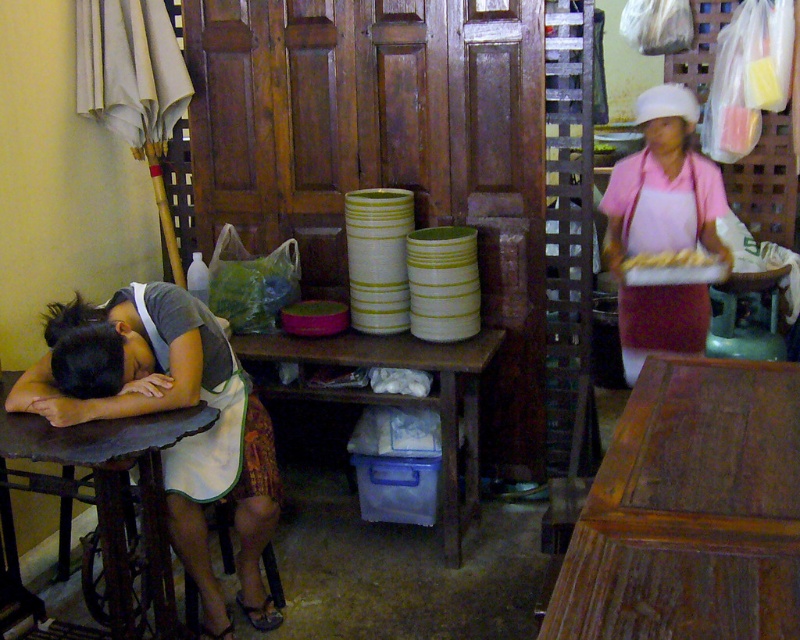
Can you confirm if pink fabric apron at right is positioned above wooden table at center?

Indeed, pink fabric apron at right is positioned over wooden table at center.

Between pink fabric apron at right and wooden table at center, which one is positioned lower?

Positioned lower is wooden table at center.

Which is behind, point (684, 125) or point (438, 372)?

The point (438, 372) is more distant.

Locate an element on the screen. This screenshot has width=800, height=640. pink fabric apron at right is located at coordinates (662, 227).

Who is lower down, pink fabric apron at right or golden crispy bread at center?

Positioned lower is golden crispy bread at center.

Is pink fabric apron at right taller than golden crispy bread at center?

Indeed, pink fabric apron at right has a greater height compared to golden crispy bread at center.

Between point (694, 285) and point (702, 256), which one is positioned in front?

Point (702, 256) is more forward.

Identify the location of pink fabric apron at right. (662, 227).

Can you confirm if wooden table at lower right is bigger than golden crispy bread at center?

Yes.

Is wooden table at lower right in front of golden crispy bread at center?

Yes, wooden table at lower right is in front of golden crispy bread at center.

Does point (608, 529) come behind point (629, 269)?

That is False.

This screenshot has width=800, height=640. I want to click on wooden table at lower right, so click(x=690, y=509).